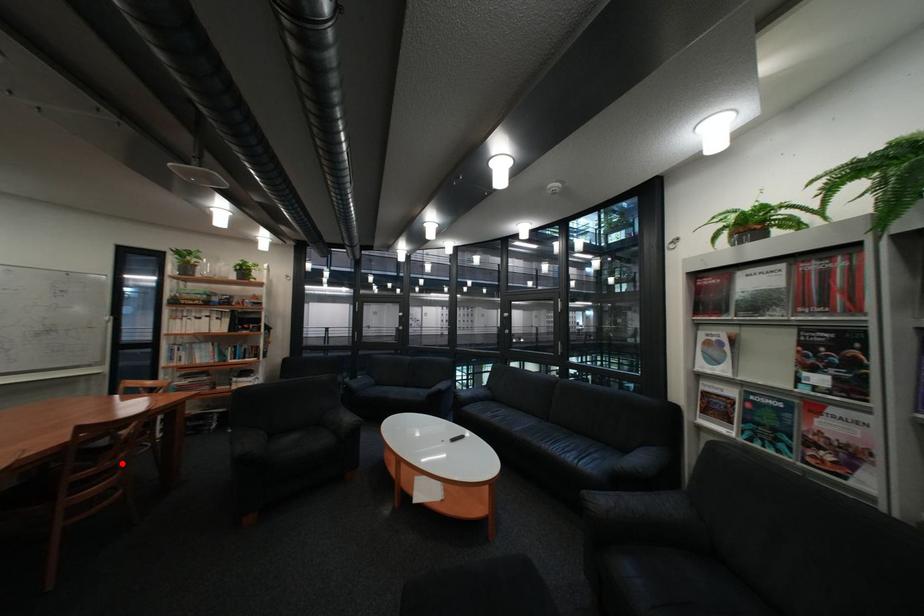
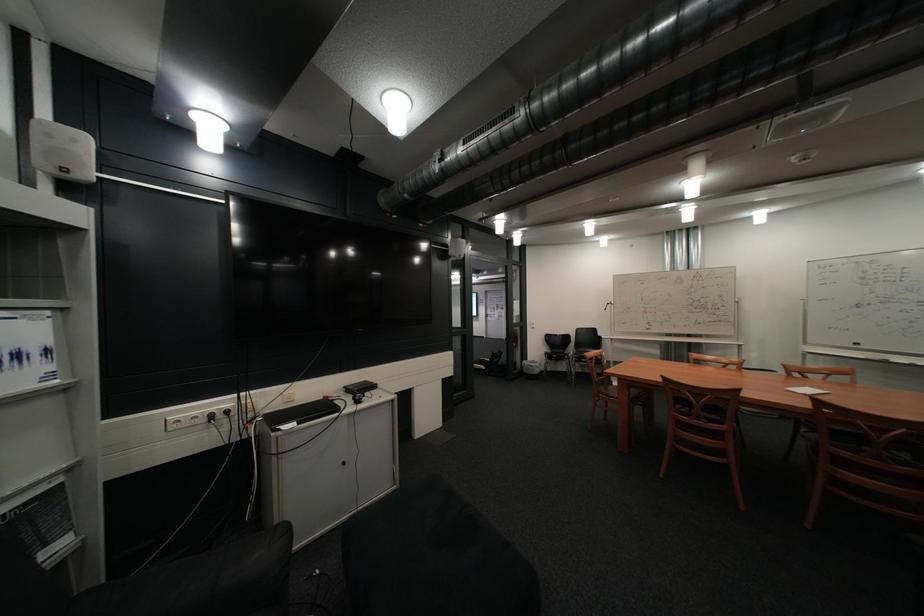
Where in the second image is the point corresponding to the highlighted location from the first image?

(888, 460)